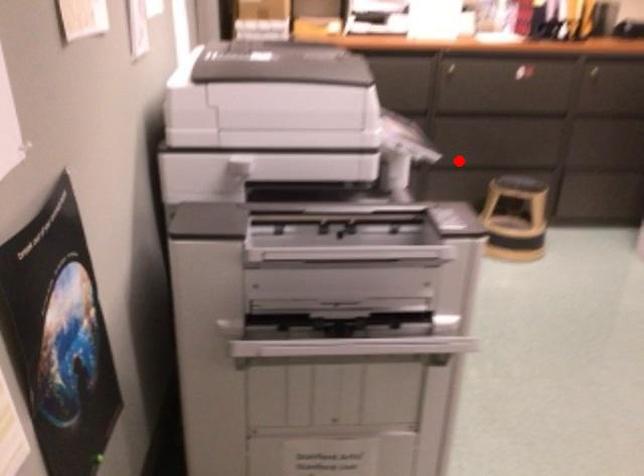
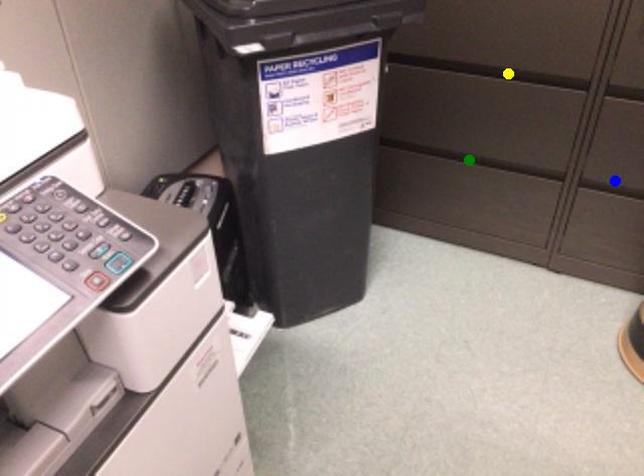
Question: I am providing you with two images of the same scene from different viewpoints. A red point is marked on the first image. You are given multiple points on the second image. Can you choose the point in image 2 that corresponds to the point in image 1?

Choices:
 (A) blue point
 (B) green point
 (C) yellow point

Answer: (A)